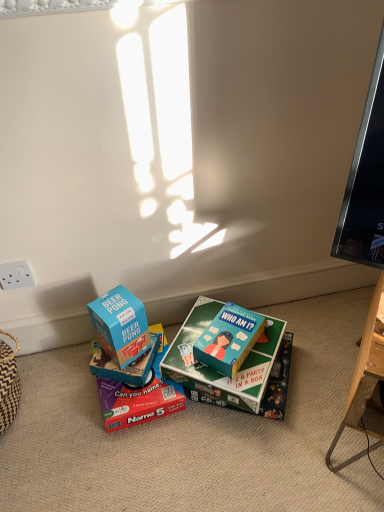
Where is `unoccupied area in front of matte cardboard box at center, which is counted as the 3th box, starting from the right`? Image resolution: width=384 pixels, height=512 pixels. unoccupied area in front of matte cardboard box at center, which is counted as the 3th box, starting from the right is located at coordinates (130, 461).